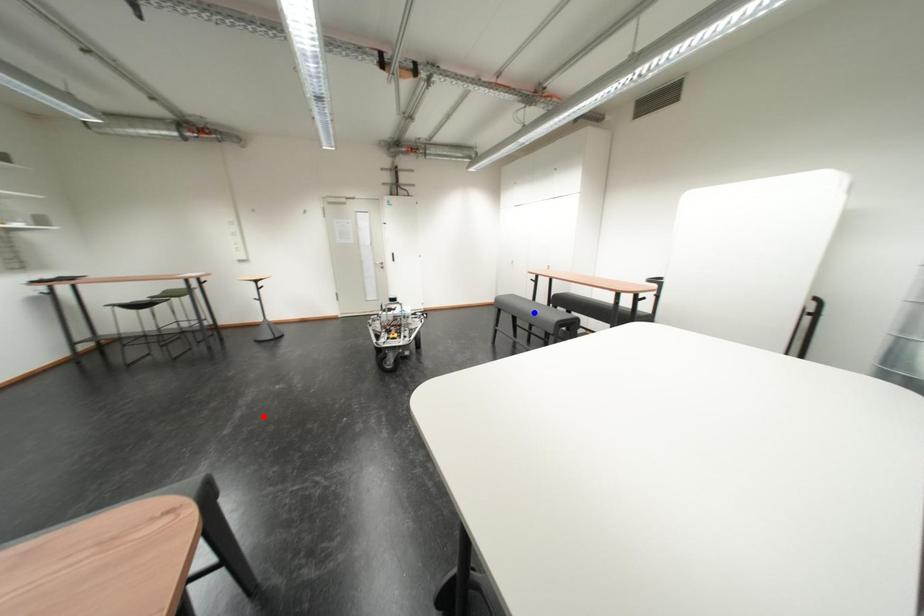
Question: In the image, two points are highlighted. Which point is nearer to the camera? Reply with the corresponding letter.

Choices:
 (A) blue point
 (B) red point

Answer: (B)